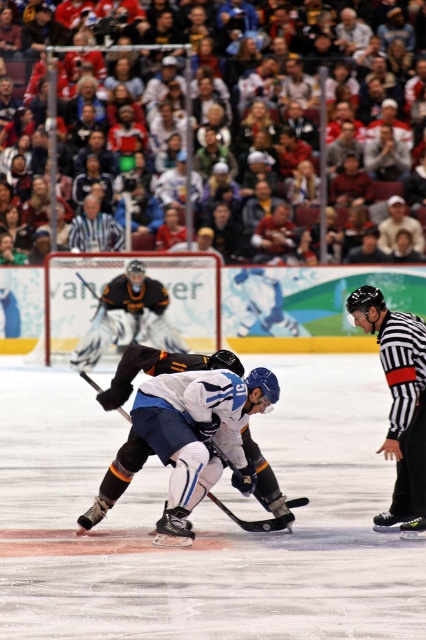
Can you confirm if black matte goalie at center is shorter than striped referee shirt at center?

No.

Measure the distance between black matte goalie at center and camera.

50.05 feet

Find the location of a particular element. Image resolution: width=426 pixels, height=640 pixels. black matte goalie at center is located at coordinates (127, 317).

Who is more forward, (77, 221) or (276, 518)?

Point (276, 518) is more forward.

Can you confirm if striped referee shirt at center is positioned above black matte hockey stick at center?

Yes.

Find the location of a particular element. This screenshot has height=640, width=426. striped referee shirt at center is located at coordinates (94, 228).

Does black and white striped referee at right lie in front of striped referee shirt at center?

Yes.

Which is behind, point (416, 365) or point (86, 250)?

Point (86, 250)

Is point (409, 484) positioned in front of point (112, 240)?

Yes, it is.

The image size is (426, 640). Identify the location of black and white striped referee at right. [400, 403].